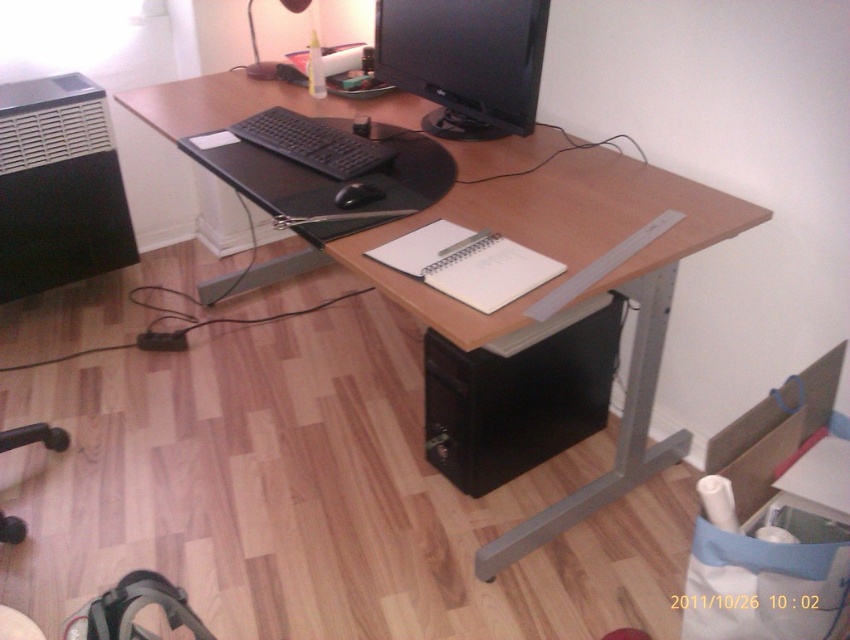
Looking at this image, you are a delivery person entering the home office and need to place a small package on the wooden computer desk at center and the black matte mouse at center. Which surface should you place it on if you want it to be closer to the viewer?

You should place the package on the wooden computer desk at center because it is closer to the viewer than the black matte mouse at center.

You are setting up a new desk layout and want to place a decorative item between the black matte keyboard at center and the black matte mouse at center. Given their widths, which object should you place the item next to to ensure it fits better?

The black matte keyboard at center is wider than the black matte mouse at center. To ensure the decorative item fits better, place it next to the black matte mouse at center since it has less width and allows more space for the item.

You are a delivery person standing in front of the wooden computer desk at center. You need to place a package that is 1.2 meters long on the desk. Can the package fit on the desk without overhanging the edges?

The wooden computer desk at center is 1.14 meters away from the viewer, but the distance does not indicate the desk length. The provided information does not specify the desk dimensions, so it is impossible to determine if the package will fit.